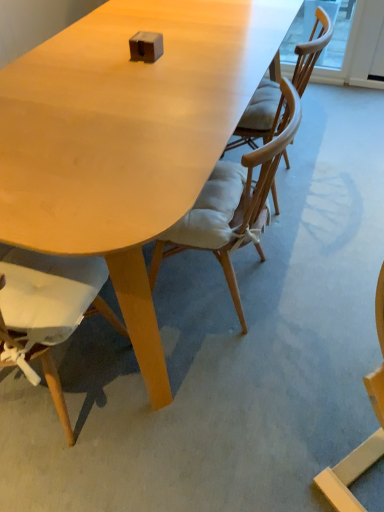
Image resolution: width=384 pixels, height=512 pixels. Find the location of `free space to the right of matte wood chair at lower left, the first chair from the left`. free space to the right of matte wood chair at lower left, the first chair from the left is located at coordinates (185, 404).